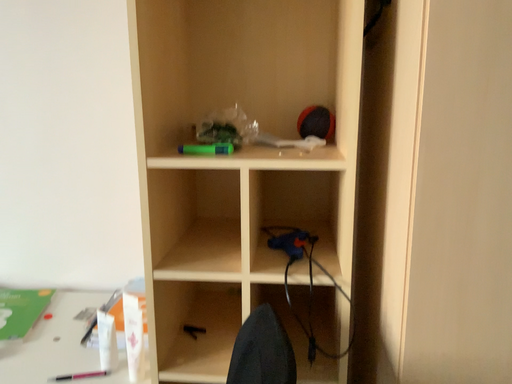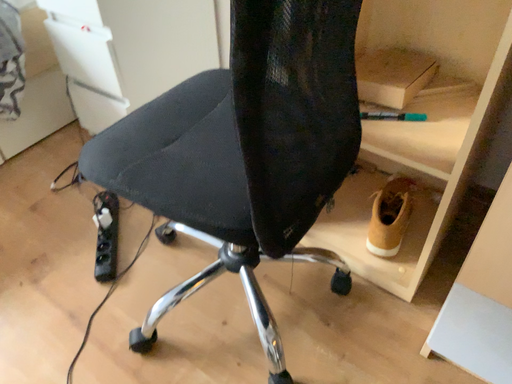
Question: How did the camera likely rotate when shooting the video?

Choices:
 (A) rotated left
 (B) rotated right

Answer: (A)